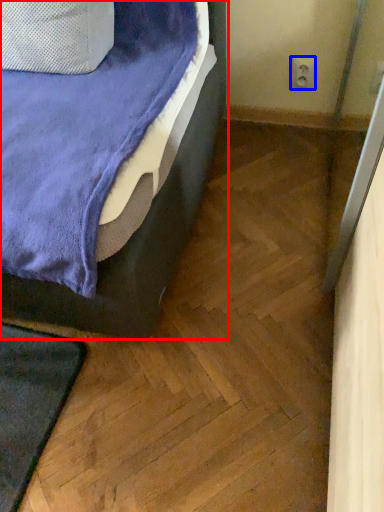
Question: Which of the following is the farthest to the observer, bed (highlighted by a red box) or electric outlet (highlighted by a blue box)?

Choices:
 (A) bed
 (B) electric outlet

Answer: (B)